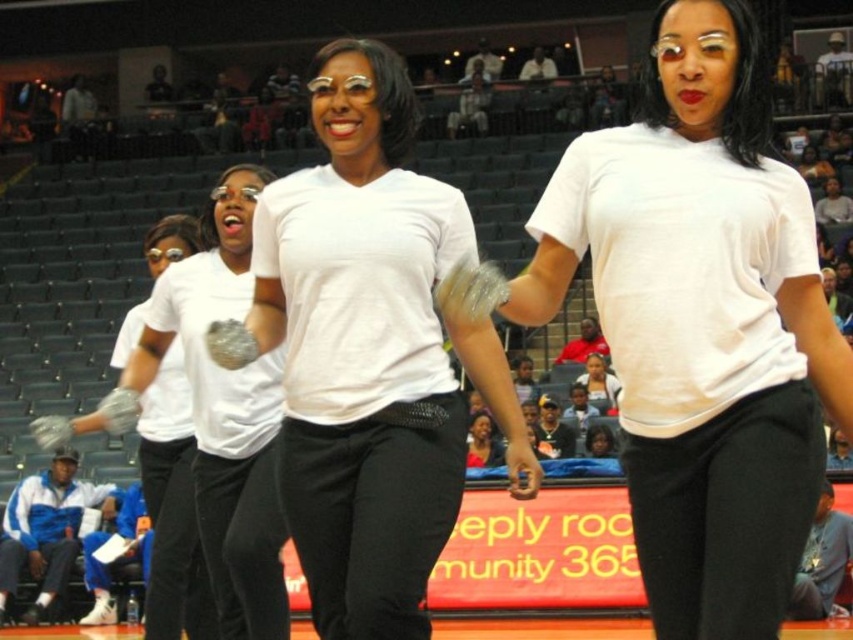
You are a photographer standing at the edge of the basketball court. You want to take a photo of the white matte glove at center and the white matte gloves at center. Can you fit both objects in your camera frame if your camera has a maximum horizontal field of view of 2.5 meters?

The white matte glove at center is 2.42 meters from white matte gloves at center. Since the distance between them is less than the camera frame width of 2.5 meters, both objects can be captured in the same photo.

You are standing at the point with coordinates point (200,310) and want to throw a ball to the point (398,301). Considering the spatial arrangement in the image, will the ball travel towards the camera or away from it?

The ball will travel towards the camera because point (398,301) is closer to the camera than point (200,310).